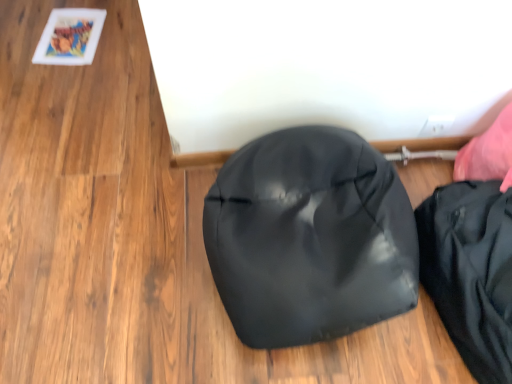
Measure the distance between point (333, 148) and camera.

They are 1.05 meters apart.

The width and height of the screenshot is (512, 384). Describe the element at coordinates (310, 238) in the screenshot. I see `matte black shoe at center` at that location.

In order to face matte black shoe at center, should I rotate leftwards or rightwards?

A 7.836 degree turn to the right will do.

The image size is (512, 384). What are the coordinates of `matte black shoe at center` in the screenshot? It's located at (310, 238).

This screenshot has width=512, height=384. What do you see at coordinates (471, 271) in the screenshot?
I see `black matte pouch at lower right` at bounding box center [471, 271].

You are a GUI agent. You are given a task and a screenshot of the screen. Output one action in this format:
    pyautogui.click(x=<x>, y=<y>)
    Task: Click on the black matte pouch at lower right
    The width and height of the screenshot is (512, 384).
    Given the screenshot: What is the action you would take?
    pyautogui.click(x=471, y=271)

Where is `matte black shoe at center`? This screenshot has height=384, width=512. matte black shoe at center is located at coordinates (310, 238).

Considering the relative positions of black matte pouch at lower right and matte black shoe at center in the image provided, is black matte pouch at lower right to the left or to the right of matte black shoe at center?

Based on their positions, black matte pouch at lower right is located to the right of matte black shoe at center.

Relative to matte black shoe at center, is black matte pouch at lower right in front or behind?

Clearly, black matte pouch at lower right is behind matte black shoe at center.

Does point (457, 238) lie behind point (288, 201)?

No.

From the image's perspective, is black matte pouch at lower right above matte black shoe at center?

Incorrect, from the image's perspective, black matte pouch at lower right is lower than matte black shoe at center.

From a real-world perspective, which object rests below the other?

In real-world perspective, black matte pouch at lower right is lower.

Is black matte pouch at lower right thinner than matte black shoe at center?

Correct, the width of black matte pouch at lower right is less than that of matte black shoe at center.

Considering the relative sizes of black matte pouch at lower right and matte black shoe at center in the image provided, is black matte pouch at lower right taller than matte black shoe at center?

Yes, black matte pouch at lower right is taller than matte black shoe at center.

Does black matte pouch at lower right have a larger size compared to matte black shoe at center?

No.

Would you say black matte pouch at lower right is inside or outside matte black shoe at center?

black matte pouch at lower right cannot be found inside matte black shoe at center.

Would you consider black matte pouch at lower right to be distant from matte black shoe at center?

No, black matte pouch at lower right is not far away from matte black shoe at center.

Is black matte pouch at lower right facing away from matte black shoe at center?

No, matte black shoe at center is not at the back of black matte pouch at lower right.

Can you tell me how much black matte pouch at lower right and matte black shoe at center differ in facing direction?

black matte pouch at lower right and matte black shoe at center are facing 2.51e-05 degrees away from each other.

This screenshot has height=384, width=512. What are the coordinates of `pouch below the matte black shoe at center (from a real-world perspective)` in the screenshot? It's located at (471, 271).

Is matte black shoe at center to the left of black matte pouch at lower right from the viewer's perspective?

Yes.

Which object is more forward, matte black shoe at center or black matte pouch at lower right?

Positioned in front is matte black shoe at center.

Considering the positions of points (249, 170) and (476, 369), is point (249, 170) closer to camera compared to point (476, 369)?

No, it is not.

From the image's perspective, would you say matte black shoe at center is shown under black matte pouch at lower right?

No.

From a real-world perspective, is matte black shoe at center positioned above or below black matte pouch at lower right?

In terms of real-world spatial position, matte black shoe at center is above black matte pouch at lower right.

Is matte black shoe at center wider than black matte pouch at lower right?

Yes, matte black shoe at center is wider than black matte pouch at lower right.

Which of these two, matte black shoe at center or black matte pouch at lower right, stands shorter?

With less height is matte black shoe at center.

Considering the sizes of objects matte black shoe at center and black matte pouch at lower right in the image provided, who is smaller, matte black shoe at center or black matte pouch at lower right?

With smaller size is black matte pouch at lower right.

Would you say matte black shoe at center is outside black matte pouch at lower right?

Yes, matte black shoe at center is outside of black matte pouch at lower right.

Are matte black shoe at center and black matte pouch at lower right beside each other?

No, matte black shoe at center is not next to black matte pouch at lower right.

Is matte black shoe at center oriented away from black matte pouch at lower right?

No, black matte pouch at lower right is not at the back of matte black shoe at center.

What's the angular difference between matte black shoe at center and black matte pouch at lower right's facing directions?

There is a 2.51e-05-degree angle between the facing directions of matte black shoe at center and black matte pouch at lower right.

The height and width of the screenshot is (384, 512). In order to click on footwear in front of the black matte pouch at lower right in this screenshot , I will do `click(310, 238)`.

Identify the location of footwear in front of the black matte pouch at lower right. (310, 238).

Find the location of a particular element. pouch that is under the matte black shoe at center (from a real-world perspective) is located at coordinates (471, 271).